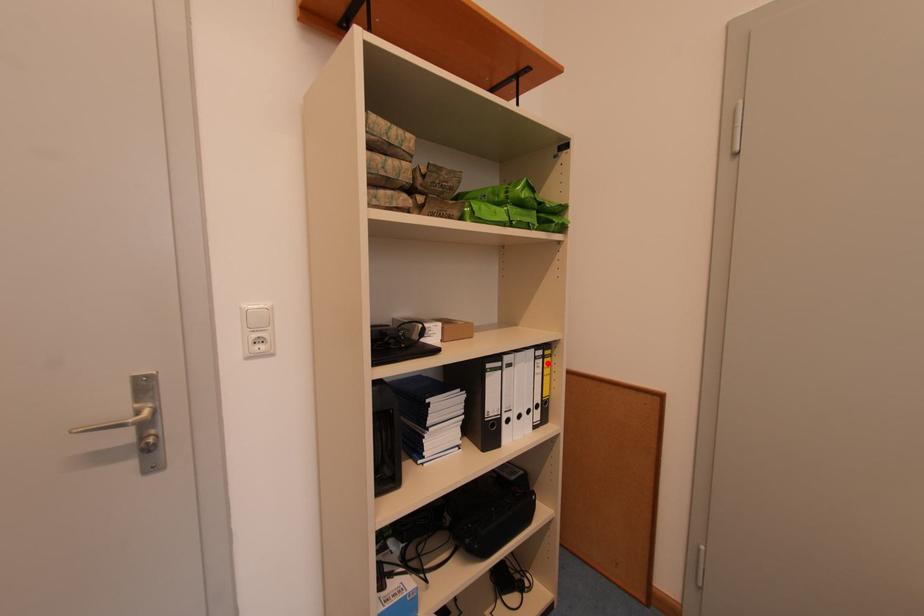
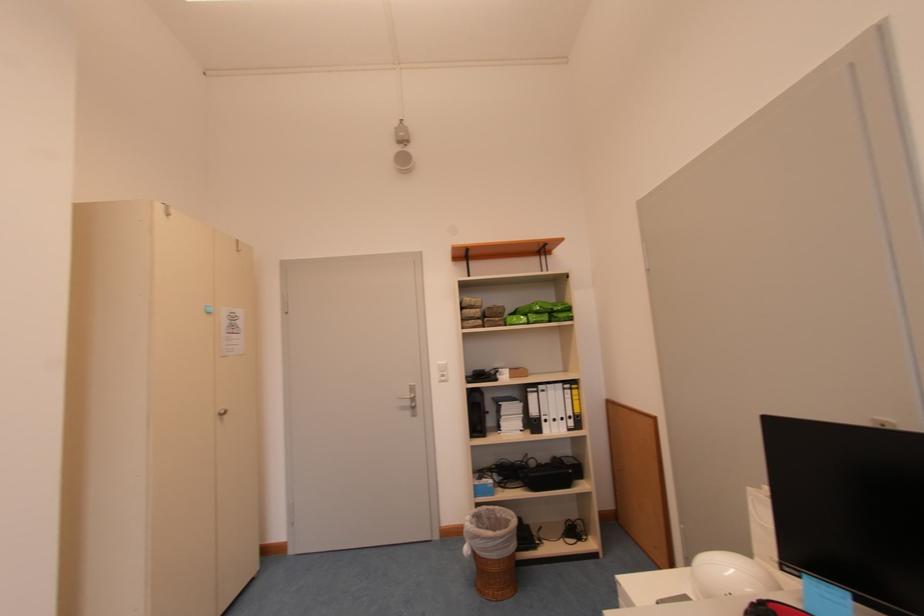
The point at the highlighted location is marked in the first image. Where is the corresponding point in the second image?

(576, 392)